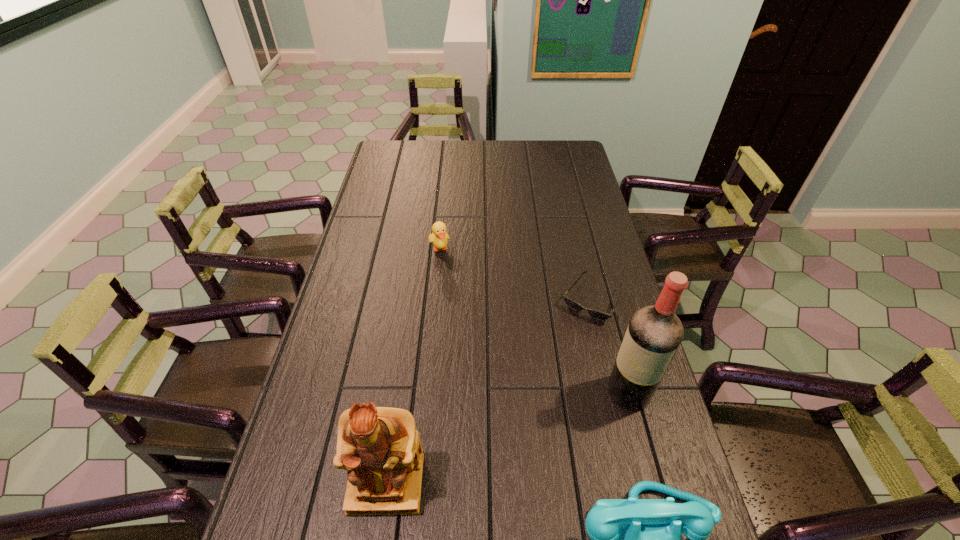
Where is `vacant space located 0.290m on the front-facing side of the sunglasses`? vacant space located 0.290m on the front-facing side of the sunglasses is located at coordinates (538, 397).

Locate an element on the screen. The image size is (960, 540). vacant space situated on the front-facing side of the sunglasses is located at coordinates (527, 415).

At what (x,y) coordinates should I click in order to perform the action: click on vacant space located 0.170m on the front-facing side of the sunglasses. Please return your answer as a coordinate pair (x, y). The width and height of the screenshot is (960, 540). Looking at the image, I should click on (556, 363).

The width and height of the screenshot is (960, 540). In order to click on free location located on the front-facing side of the duckling in this screenshot , I will do `click(461, 311)`.

This screenshot has height=540, width=960. I want to click on free spot located 0.120m on the front-facing side of the duckling, so click(x=450, y=282).

Where is `vacant space located 0.120m on the front-facing side of the duckling`? vacant space located 0.120m on the front-facing side of the duckling is located at coordinates (450, 282).

In order to click on object that is at the near edge in this screenshot , I will do `click(380, 447)`.

Locate an element on the screen. liquor at the right edge is located at coordinates (654, 333).

Locate an element on the screen. The width and height of the screenshot is (960, 540). sunglasses at the right edge is located at coordinates (596, 314).

Where is `vacant space at the near edge`? The height and width of the screenshot is (540, 960). vacant space at the near edge is located at coordinates (514, 515).